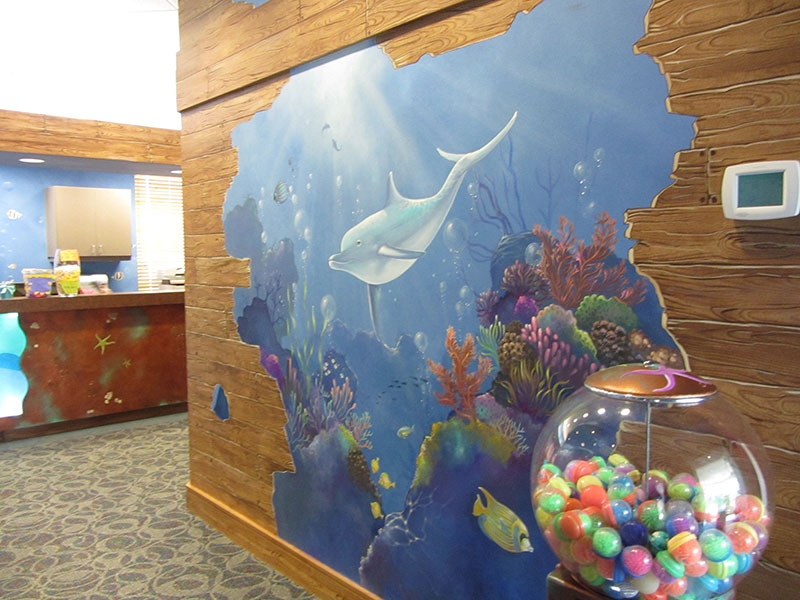
Where is `ceiling`? Image resolution: width=800 pixels, height=600 pixels. ceiling is located at coordinates (62, 48).